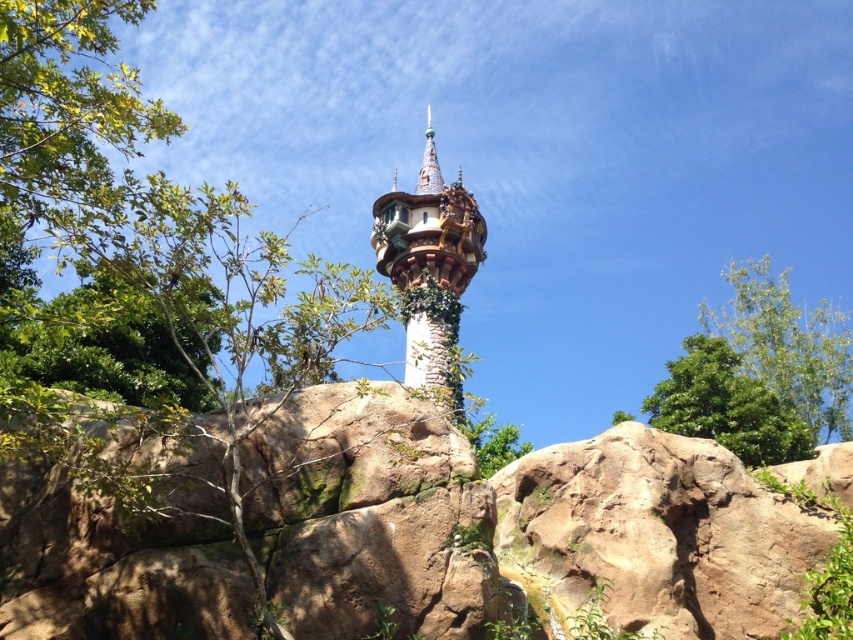
Question: Does brown rough rock at center have a larger size compared to green leafy tree at upper right?

Choices:
 (A) yes
 (B) no

Answer: (B)

Question: Is white stone tower at center behind green leafy tree at upper right?

Choices:
 (A) no
 (B) yes

Answer: (A)

Question: Does green leafy tree at upper left appear under green leafy tree at upper right?

Choices:
 (A) yes
 (B) no

Answer: (B)

Question: Which point is closer to the camera?

Choices:
 (A) (666, 460)
 (B) (397, 486)
 (C) (804, 426)
 (D) (233, 394)

Answer: (B)

Question: Estimate the real-world distances between objects in this image. Which object is closer to the green leafy tree at upper right?

Choices:
 (A) brown rough rock at lower right
 (B) green leafy tree at upper left

Answer: (A)

Question: Which of the following is the farthest from the observer?

Choices:
 (A) green leafy tree at upper left
 (B) white stone tower at center

Answer: (B)